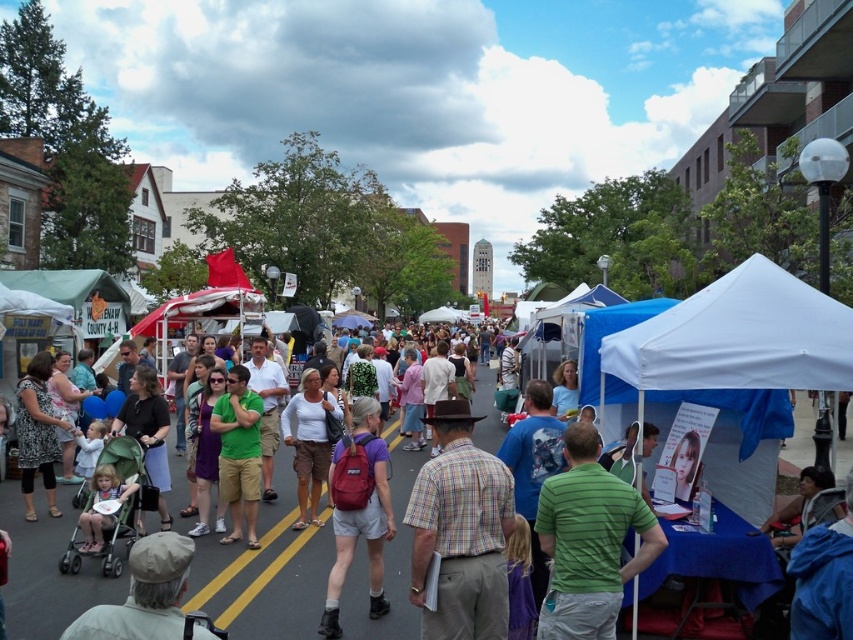
Who is shorter, plaid cotton shirt at center or printed fabric dress at left?

With less height is plaid cotton shirt at center.

Is point (480, 460) farther from camera compared to point (45, 477)?

That is False.

The image size is (853, 640). Identify the location of plaid cotton shirt at center. (460, 531).

Is green striped shirt at center bigger than matte red backpack at center?

Actually, green striped shirt at center might be smaller than matte red backpack at center.

Who is positioned more to the right, green striped shirt at center or matte red backpack at center?

Positioned to the right is green striped shirt at center.

Identify the location of green striped shirt at center. [589, 541].

Between plaid cotton shirt at center and matte red backpack at center, which one is positioned higher?

plaid cotton shirt at center is above.

Does point (434, 417) come behind point (331, 493)?

That is False.

Does point (437, 458) come in front of point (332, 474)?

Yes, it is.

Find the location of `plaid cotton shirt at center`. plaid cotton shirt at center is located at coordinates (460, 531).